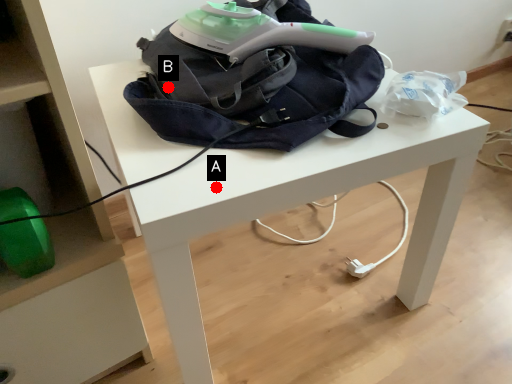
Question: Two points are circled on the image, labeled by A and B beside each circle. Which of the following is the closest to the observer?

Choices:
 (A) A is closer
 (B) B is closer

Answer: (A)